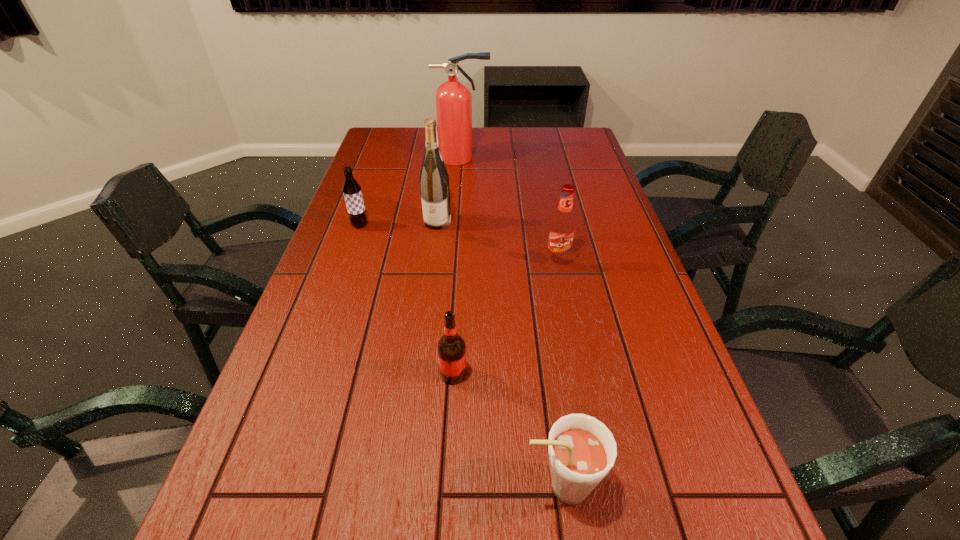
Find the location of a particular element. The image size is (960, 540). vacant area that lies between the third root beer from right to left and the leftmost root beer is located at coordinates (406, 300).

Locate an element on the screen. free space between the second root beer from left to right and the fire extinguisher is located at coordinates (458, 266).

In order to click on free spot between the nearest object and the third tallest object in this screenshot , I will do `click(559, 373)`.

This screenshot has height=540, width=960. I want to click on vacant space in between the third root beer from right to left and the fire extinguisher, so click(458, 266).

Where is `object that is the third closest to the wine bottle`? object that is the third closest to the wine bottle is located at coordinates (453, 99).

Find the location of a particular element. This screenshot has height=540, width=960. object that can be found as the fourth closest to the wine bottle is located at coordinates (451, 347).

Point out which root beer is positioned as the third nearest to the farthest object. Please provide its 2D coordinates. Your answer should be formatted as a tuple, i.e. [(x, y)], where the tuple contains the x and y coordinates of a point satisfying the conditions above.

[(451, 347)]

Identify which root beer is the third nearest to the leftmost root beer. Please provide its 2D coordinates. Your answer should be formatted as a tuple, i.e. [(x, y)], where the tuple contains the x and y coordinates of a point satisfying the conditions above.

[(581, 449)]

Locate an element on the screen. This screenshot has width=960, height=540. free location that satisfies the following two spatial constraints: 1. on the front side of the fire extinguisher; 2. on the right side of the third tallest object is located at coordinates (456, 260).

Locate an element on the screen. This screenshot has height=540, width=960. vacant region that satisfies the following two spatial constraints: 1. on the back side of the third tallest object; 2. on the left side of the fifth farthest object is located at coordinates (459, 260).